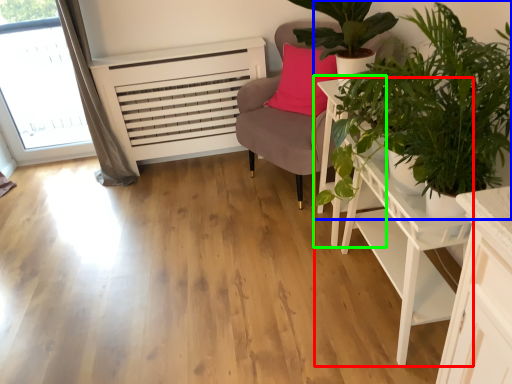
Question: Which is nearer to the table (highlighted by a red box)? houseplant (highlighted by a blue box) or side table (highlighted by a green box).

Choices:
 (A) houseplant
 (B) side table

Answer: (B)